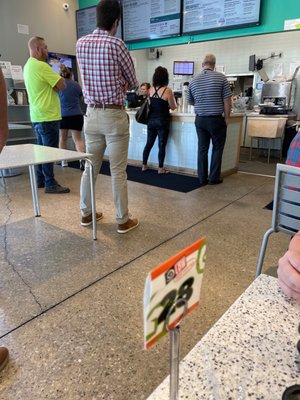
You are a GUI agent. You are given a task and a screenshot of the screen. Output one action in this format:
    pyautogui.click(x=<x>, y=<y>)
    Task: Click on the chair
    
    Given the screenshot: What is the action you would take?
    pyautogui.click(x=287, y=196)